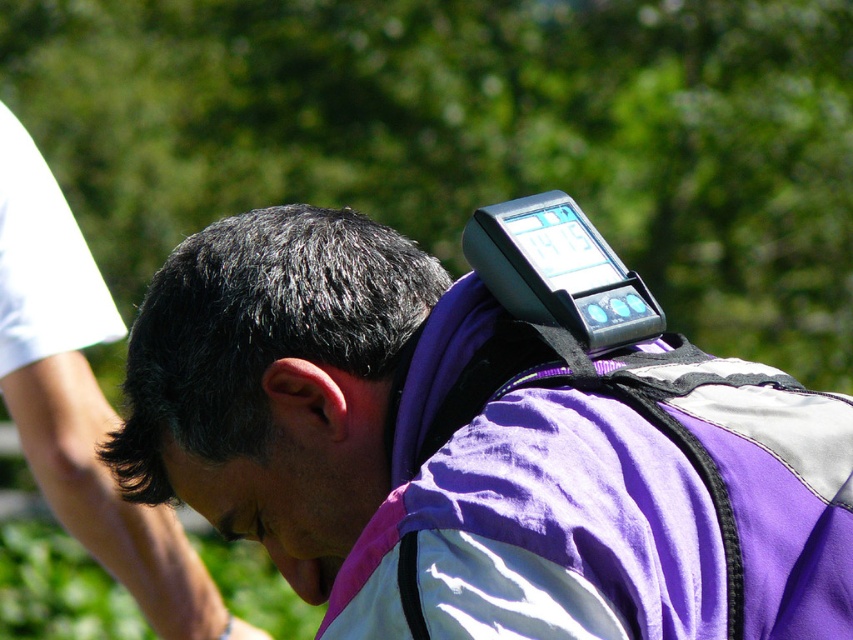
You are planning to attach a small camera to your equipment while hiking. You have two options on the image provided, the purple fabric backpack at upper center and the matte black forehead at center. Which object would you choose to attach the camera so that it is visible and accessible?

The purple fabric backpack at upper center is taller than the matte black forehead at center, so attaching the camera there would provide better visibility and accessibility.

You are a hiker preparing to take a photo of the purple fabric backpack at upper center and the matte black forehead at center. Which object should you focus on first if you want to capture both in a single frame?

The purple fabric backpack at upper center is positioned over the matte black forehead at center, so you should focus on the purple fabric backpack at upper center first to ensure both are in the frame.

You are trying to determine which point is nearer to your eyes while observing the image. Given the two points labeled as point (230, 227) and point (175, 493), which one is closer to you?

Point (230, 227) is closer to the camera than point (175, 493).